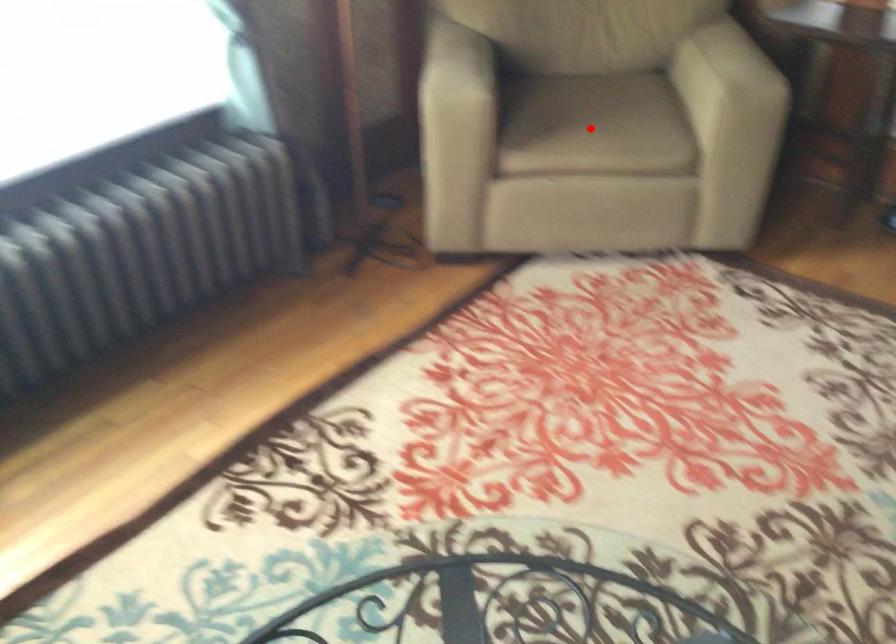
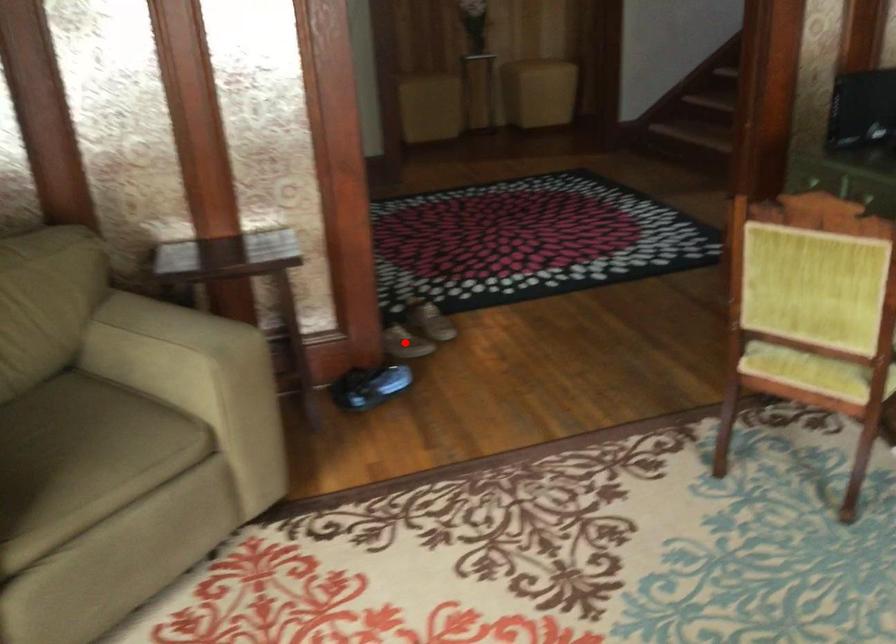
I am providing you with two images of the same scene from different viewpoints. A red point is marked on the first image and another point is marked on the second image. Is the red point in image1 aligned with the point shown in image2?

No